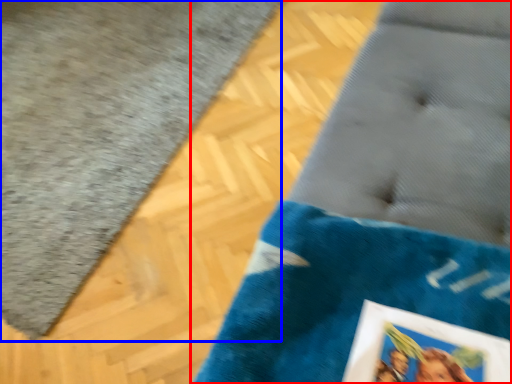
Question: Which of the following is the closest to the observer, furniture (highlighted by a red box) or bath mat (highlighted by a blue box)?

Choices:
 (A) furniture
 (B) bath mat

Answer: (A)